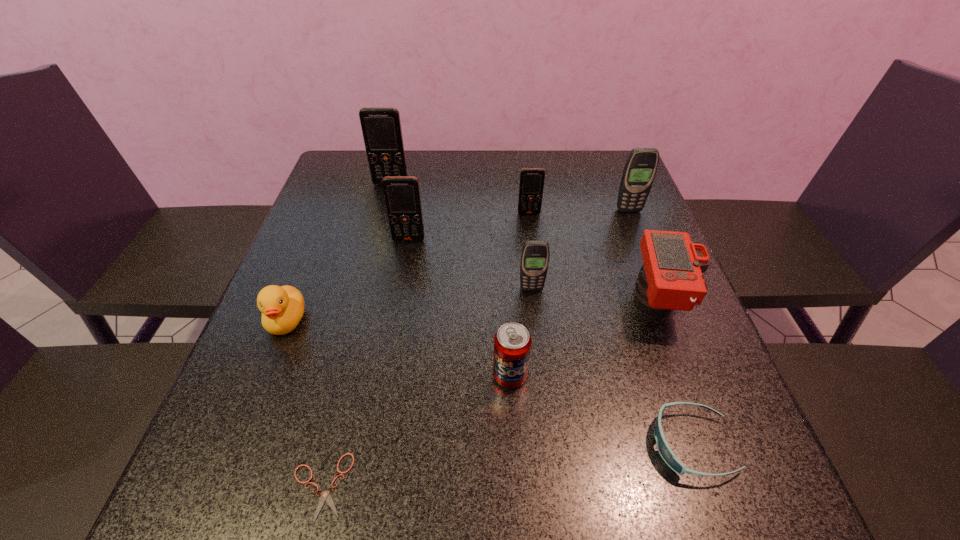
Where is `free space located 0.320m on the screen of the rightmost orange cellular telephone`? free space located 0.320m on the screen of the rightmost orange cellular telephone is located at coordinates (541, 308).

In order to click on free space located 0.140m on the screen of the smaller gray cellular telephone in this screenshot , I will do `click(538, 343)`.

This screenshot has width=960, height=540. Find the location of `free location located on the back of the camera`. free location located on the back of the camera is located at coordinates (626, 212).

I want to click on vacant area situated on the right of the red soda can, so click(641, 375).

What are the coordinates of `free space located at the beak of the yellow duck` in the screenshot? It's located at (227, 471).

I want to click on vacant space located 0.150m on the front-facing side of the goggles, so [561, 444].

Image resolution: width=960 pixels, height=540 pixels. I want to click on vacant position located on the front-facing side of the goggles, so click(x=450, y=444).

Identify the location of vacant space located 0.200m on the front-facing side of the goggles. This screenshot has width=960, height=540. (530, 444).

You are a GUI agent. You are given a task and a screenshot of the screen. Output one action in this format:
    pyautogui.click(x=<x>, y=<y>)
    Task: Click on the vacant space located 0.320m on the back of the shears
    The width and height of the screenshot is (960, 540).
    Given the screenshot: What is the action you would take?
    pyautogui.click(x=365, y=305)

Locate an element on the screen. The width and height of the screenshot is (960, 540). object present at the far edge is located at coordinates (381, 126).